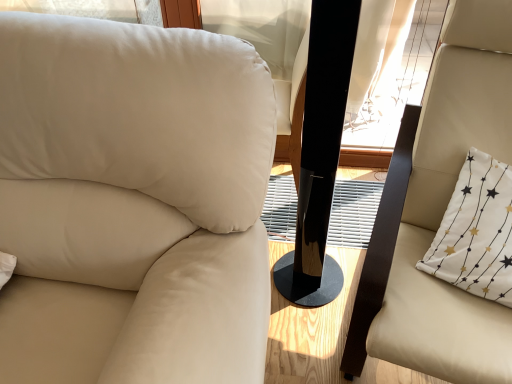
Question: Considering the relative positions of beige leather chair at left, placed as the 2th chair when sorted from right to left, and white fabric pillow at right in the image provided, is beige leather chair at left, placed as the 2th chair when sorted from right to left, to the left of white fabric pillow at right from the viewer's perspective?

Choices:
 (A) yes
 (B) no

Answer: (A)

Question: Considering the relative sizes of beige leather chair at left, which is counted as the 1th chair, starting from the left, and white fabric pillow at right in the image provided, is beige leather chair at left, which is counted as the 1th chair, starting from the left, shorter than white fabric pillow at right?

Choices:
 (A) yes
 (B) no

Answer: (B)

Question: From a real-world perspective, is beige leather chair at left, which is counted as the 1th chair, starting from the left, positioned over white fabric pillow at right based on gravity?

Choices:
 (A) no
 (B) yes

Answer: (B)

Question: Could you tell me if beige leather chair at left, placed as the 2th chair when sorted from right to left, is turned towards white fabric pillow at right?

Choices:
 (A) yes
 (B) no

Answer: (B)

Question: Does beige leather chair at left, which is counted as the 1th chair, starting from the left, appear on the right side of white fabric pillow at right?

Choices:
 (A) yes
 (B) no

Answer: (B)

Question: Is point (459, 213) positioned closer to the camera than point (312, 291)?

Choices:
 (A) closer
 (B) farther

Answer: (A)

Question: Looking at their shapes, would you say white fabric pillow at right is wider or thinner than black glossy speaker at center?

Choices:
 (A) thin
 (B) wide

Answer: (B)

Question: In terms of height, does white fabric pillow at right look taller or shorter compared to black glossy speaker at center?

Choices:
 (A) short
 (B) tall

Answer: (A)

Question: Is white fabric pillow at right in front of or behind black glossy speaker at center in the image?

Choices:
 (A) front
 (B) behind

Answer: (B)

Question: Considering their positions, is black glossy speaker at center located in front of or behind beige leather chair at left, placed as the 2th chair when sorted from right to left?

Choices:
 (A) behind
 (B) front

Answer: (A)

Question: Looking at the image, does black glossy speaker at center seem bigger or smaller compared to beige leather chair at left, placed as the 2th chair when sorted from right to left?

Choices:
 (A) big
 (B) small

Answer: (B)

Question: Is black glossy speaker at center wider or thinner than beige leather chair at left, which is counted as the 1th chair, starting from the left?

Choices:
 (A) thin
 (B) wide

Answer: (A)

Question: From a real-world perspective, relative to beige leather chair at left, which is counted as the 1th chair, starting from the left, is black glossy speaker at center vertically above or below?

Choices:
 (A) below
 (B) above

Answer: (B)

Question: Which is correct: beige leather chair at right, the 1th chair viewed from the right, is inside black glossy speaker at center, or outside of it?

Choices:
 (A) outside
 (B) inside

Answer: (A)

Question: In the image, is beige leather chair at right, the 1th chair viewed from the right, on the left side or the right side of black glossy speaker at center?

Choices:
 (A) right
 (B) left

Answer: (A)